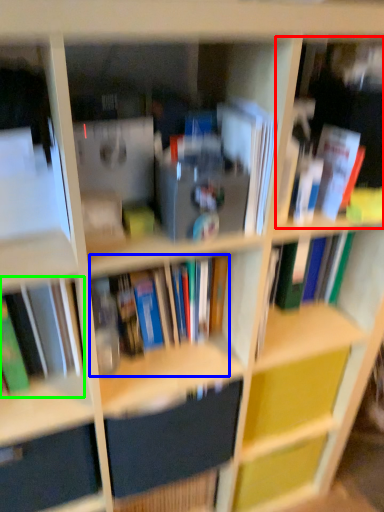
Question: Which object is the closest to the book (highlighted by a red box)? Choose among these: book (highlighted by a blue box) or book (highlighted by a green box).

Choices:
 (A) book
 (B) book

Answer: (A)